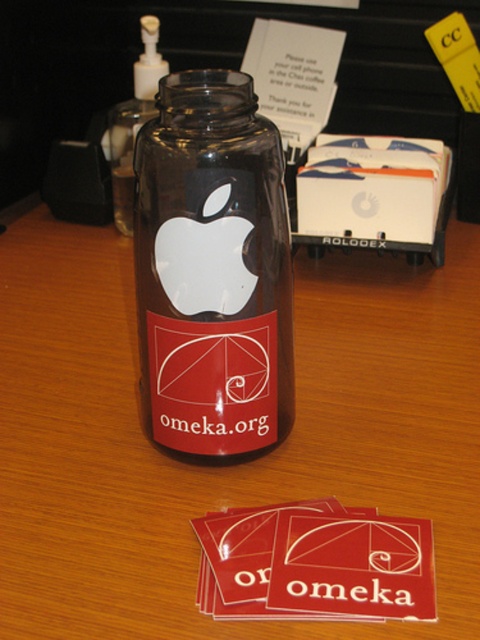
Question: Which of the following is the closest to the observer?

Choices:
 (A) (204, 204)
 (B) (137, 64)
 (C) (60, 579)

Answer: (C)

Question: Is transparent glass jar at center positioned in front of transparent glass bottle at center?

Choices:
 (A) yes
 (B) no

Answer: (A)

Question: Where is wooden table at center located in relation to transparent glass bottle at center in the image?

Choices:
 (A) above
 (B) below

Answer: (B)

Question: Is transparent glass jar at center to the right of transparent glass bottle at center from the viewer's perspective?

Choices:
 (A) yes
 (B) no

Answer: (A)

Question: Which object is positioned closest to the wooden table at center?

Choices:
 (A) transparent glass bottle at center
 (B) transparent glass jar at center

Answer: (B)

Question: Which of the following is the closest to the observer?

Choices:
 (A) transparent glass jar at center
 (B) transparent glass bottle at center

Answer: (A)